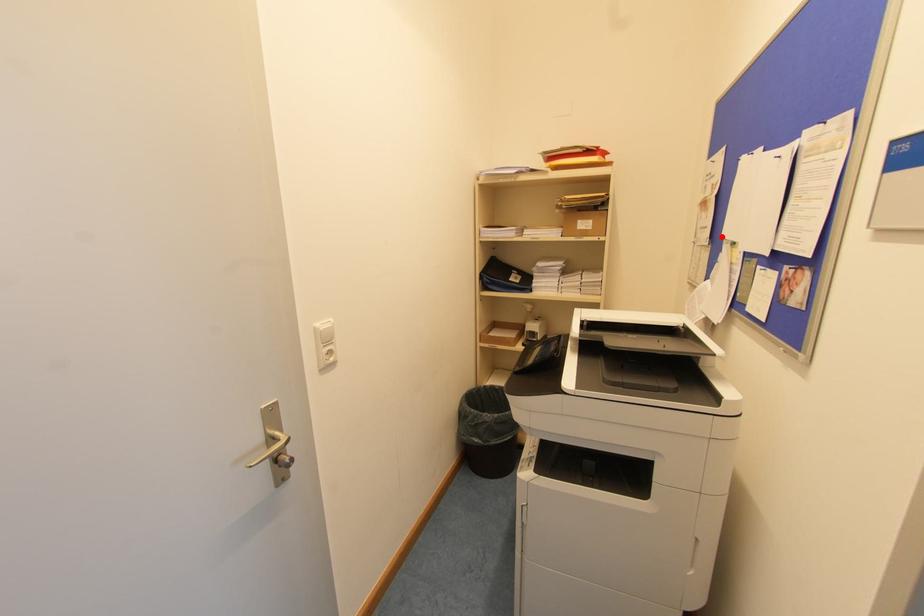
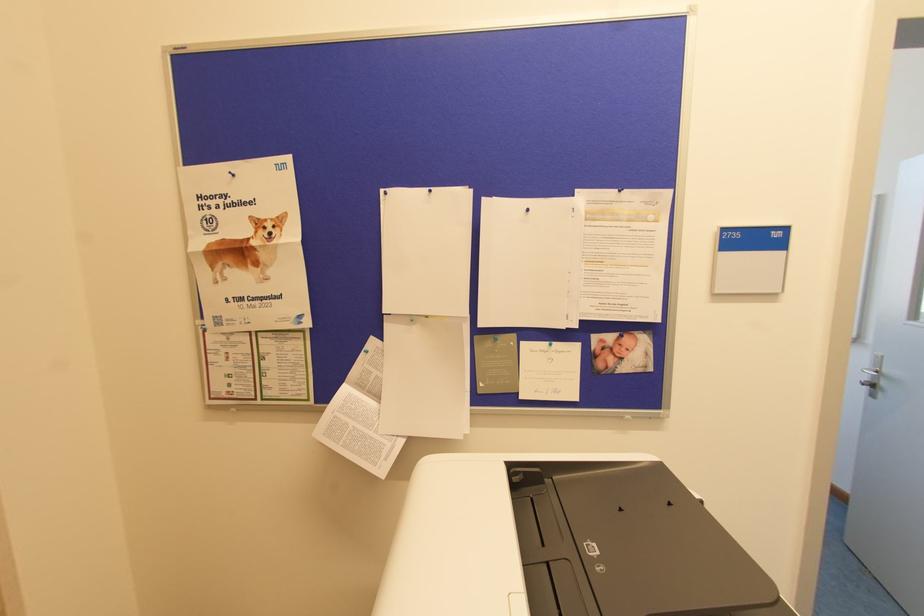
Find the pixel in the second image that matches the highlighted location in the first image.

(383, 312)